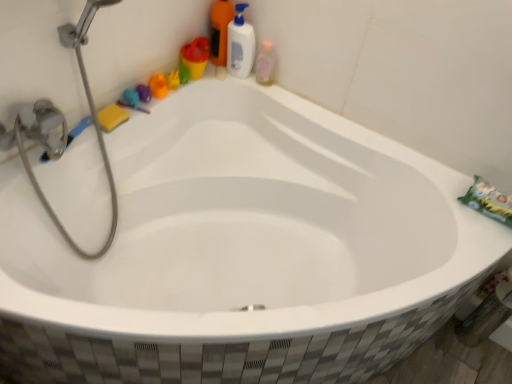
Question: In terms of width, does matte plastic cup at upper left look wider or thinner when compared to translucent plastic bottle at upper right, which is counted as the second cleaning product, starting from the right?

Choices:
 (A) thin
 (B) wide

Answer: (B)

Question: Is matte plastic cup at upper left taller or shorter than translucent plastic bottle at upper right, which is counted as the second cleaning product, starting from the right?

Choices:
 (A) short
 (B) tall

Answer: (A)

Question: Which is farther from the pink translucent bottle at upper right?

Choices:
 (A) green matte toothpaste at right
 (B) translucent plastic bottle at upper right, the 1th cleaning product from the left
 (C) matte plastic cup at upper left
 (D) rubber duck at upper left, the 2th toy in the right-to-left sequence
 (E) rubber duck at upper left, placed as the 1th toy when sorted from left to right

Answer: (A)

Question: Which object is positioned farthest from the rubber duck at upper left, placed as the third toy when sorted from right to left?

Choices:
 (A) rubber duck at upper left, the 2th toy in the right-to-left sequence
 (B) yellow sponge at upper left
 (C) yellow rubber duck at upper left, which is the third toy from left to right
 (D) translucent plastic bottle at upper right, which is counted as the second cleaning product, starting from the right
 (E) white plastic bottle at upper right, the first cleaning product in the right-to-left sequence

Answer: (E)